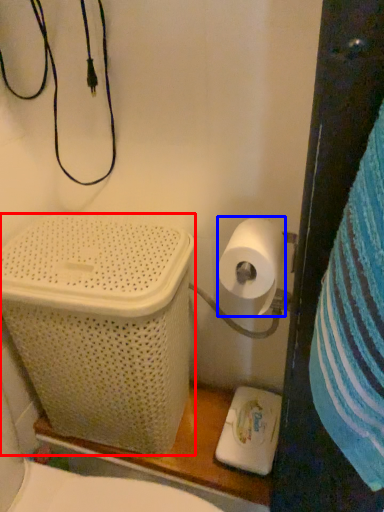
Question: Among these objects, which one is nearest to the camera, laundry basket (highlighted by a red box) or toilet paper (highlighted by a blue box)?

Choices:
 (A) laundry basket
 (B) toilet paper

Answer: (B)